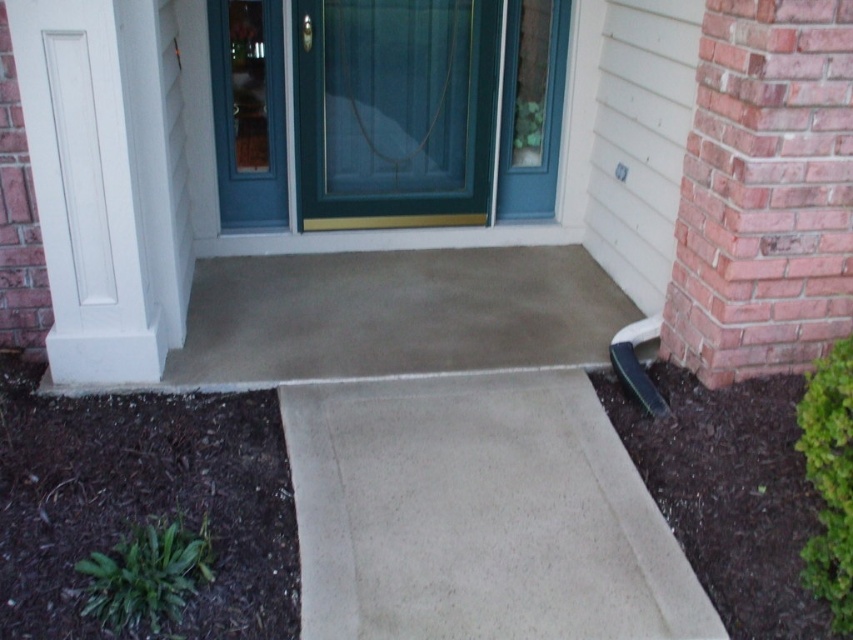
Question: Does dark brown mulch at lower left appear on the right side of white smooth column at left?

Choices:
 (A) no
 (B) yes

Answer: (B)

Question: Can you confirm if dark brown mulch at lower left is positioned to the right of white smooth column at left?

Choices:
 (A) yes
 (B) no

Answer: (A)

Question: Is dark brown mulch at lower left further to camera compared to white smooth column at left?

Choices:
 (A) yes
 (B) no

Answer: (B)

Question: Based on their relative distances, which object is farther from the dark brown mulch at lower right?

Choices:
 (A) concrete at center
 (B) dark brown mulch at lower left
 (C) beige concrete ramp at lower center
 (D) white smooth column at left

Answer: (D)

Question: Estimate the real-world distances between objects in this image. Which object is closer to the concrete at center?

Choices:
 (A) dark brown mulch at lower left
 (B) green glass screen door at center

Answer: (B)

Question: Estimate the real-world distances between objects in this image. Which object is closer to the white smooth column at left?

Choices:
 (A) dark brown mulch at lower left
 (B) beige concrete ramp at lower center
 (C) concrete at center
 (D) dark brown mulch at lower right

Answer: (A)